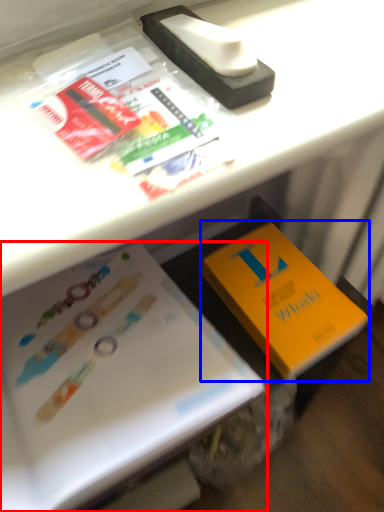
Question: Which object appears closest to the camera in this image, book (highlighted by a red box) or book (highlighted by a blue box)?

Choices:
 (A) book
 (B) book

Answer: (A)